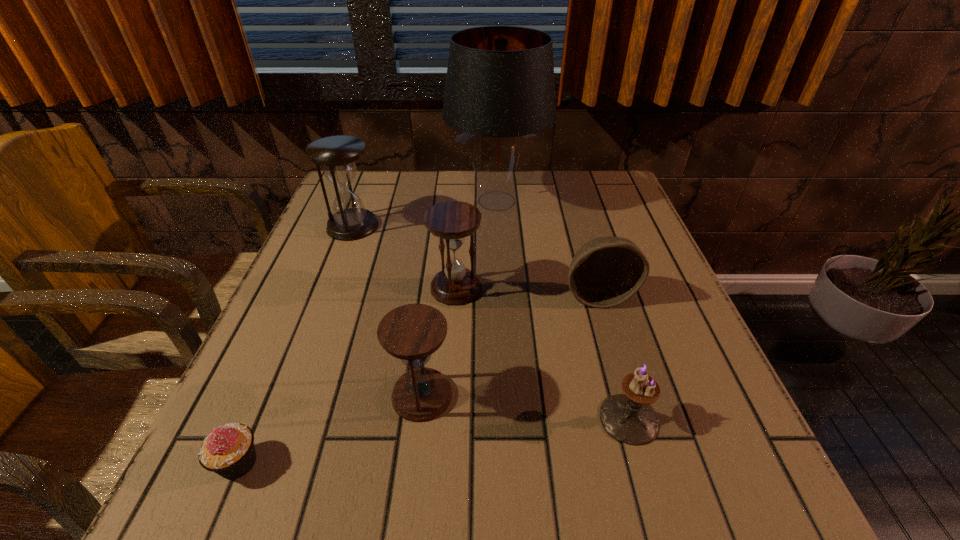
Locate an element on the screen. The image size is (960, 540). unoccupied position between the bowl and the leftmost hourglass is located at coordinates (475, 261).

Identify the location of unoccupied position between the farthest hourglass and the sixth tallest object. (491, 322).

You are a GUI agent. You are given a task and a screenshot of the screen. Output one action in this format:
    pyautogui.click(x=<x>, y=<y>)
    Task: Click on the free area in between the shortest object and the candle holder
    Image resolution: width=960 pixels, height=540 pixels.
    Given the screenshot: What is the action you would take?
    pyautogui.click(x=434, y=441)

Image resolution: width=960 pixels, height=540 pixels. In order to click on empty location between the farthest hourglass and the shortest object in this screenshot , I will do `click(296, 344)`.

Where is `vacant space in between the tallest object and the bowl`? This screenshot has width=960, height=540. vacant space in between the tallest object and the bowl is located at coordinates (547, 248).

I want to click on empty space that is in between the nearest hourglass and the bowl, so click(x=510, y=346).

Identify the location of free spot between the bowl and the candle holder. The image size is (960, 540). (613, 357).

You are a GUI agent. You are given a task and a screenshot of the screen. Output one action in this format:
    pyautogui.click(x=<x>, y=<y>)
    Task: Click on the fourth closest object to the farthest hourglass
    The image size is (960, 540).
    Given the screenshot: What is the action you would take?
    pyautogui.click(x=605, y=272)

Select which object is the fourth closest to the second farthest hourglass. Please provide its 2D coordinates. Your answer should be formatted as a tuple, i.e. [(x, y)], where the tuple contains the x and y coordinates of a point satisfying the conditions above.

[(337, 155)]

The image size is (960, 540). I want to click on hourglass object that ranks as the closest to the bowl, so click(452, 221).